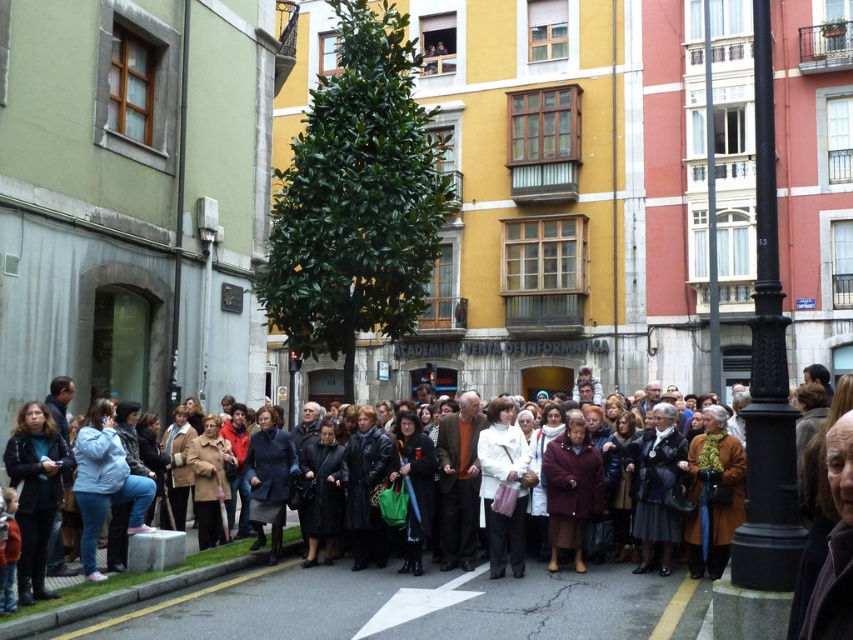
The height and width of the screenshot is (640, 853). What do you see at coordinates (572, 490) in the screenshot? I see `maroon wool coat at center` at bounding box center [572, 490].

Is maroon wool coat at center to the left of dark blue wool coat at center from the viewer's perspective?

In fact, maroon wool coat at center is to the right of dark blue wool coat at center.

Does point (550, 522) come closer to viewer compared to point (294, 467)?

Yes.

Locate an element on the screen. This screenshot has height=640, width=853. maroon wool coat at center is located at coordinates (572, 490).

Does point (503, 435) come behind point (550, 477)?

That is False.

Between point (511, 525) and point (572, 525), which one is positioned behind?

Point (572, 525)

Locate an element on the screen. white matte coat at center is located at coordinates (503, 486).

Is black metal pole at right closer to camera compared to maroon wool coat at center?

A: Yes, it is.

Which is below, black metal pole at right or maroon wool coat at center?

maroon wool coat at center

The width and height of the screenshot is (853, 640). Identify the location of black metal pole at right. (767, 371).

Identify the location of black metal pole at right. (767, 371).